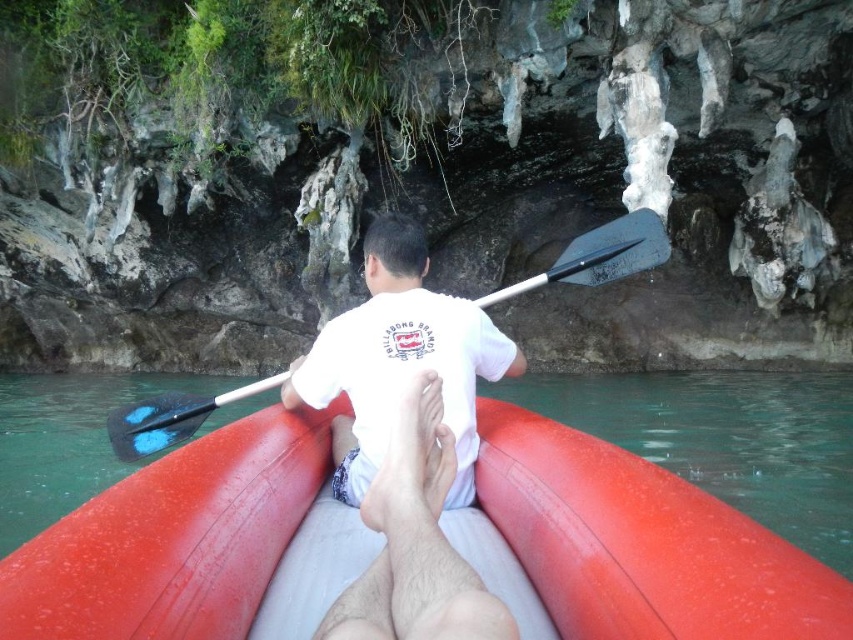
Between white cotton shirt at center and black wood paddle at center, which one has more height?

Standing taller between the two is black wood paddle at center.

Is white cotton shirt at center bigger than black wood paddle at center?

Actually, white cotton shirt at center might be smaller than black wood paddle at center.

Describe the element at coordinates (415, 541) in the screenshot. I see `white cotton shirt at center` at that location.

Identify the location of white cotton shirt at center. Image resolution: width=853 pixels, height=640 pixels. (415, 541).

Is point (849, 625) farther from camera compared to point (532, 289)?

No, it is not.

Where is `rubber boat at center`? This screenshot has width=853, height=640. rubber boat at center is located at coordinates (676, 502).

Is rubber boat at center positioned in front of white cotton shirt at center?

That is True.

Can you confirm if rubber boat at center is taller than white cotton shirt at center?

Indeed, rubber boat at center has a greater height compared to white cotton shirt at center.

Between point (94, 476) and point (402, 444), which one is positioned in front?

Point (402, 444) is in front.

Find the location of a particular element. The height and width of the screenshot is (640, 853). rubber boat at center is located at coordinates (676, 502).